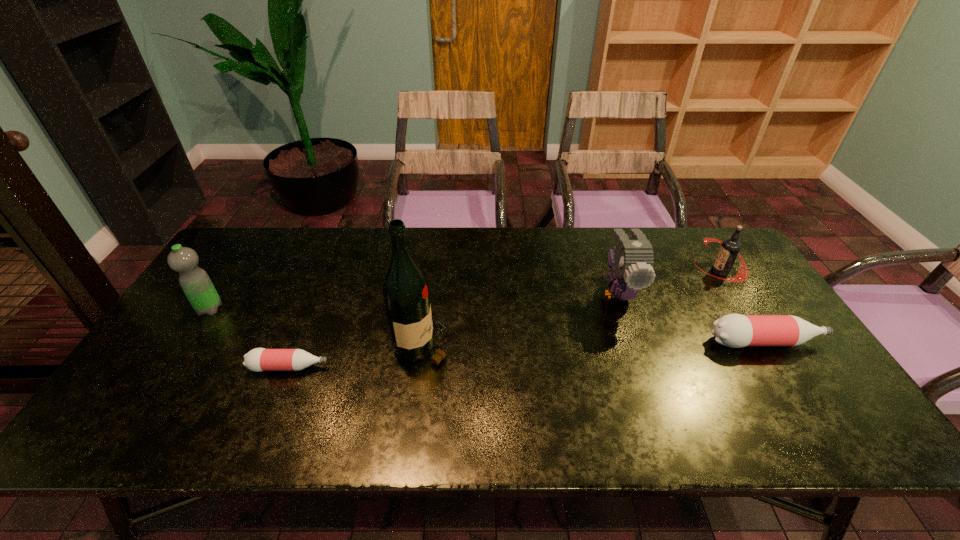
If equal spacing is the goal by inserting an additional bottle among them, please point out a vacant space for this new bottle. Please provide its 2D coordinates. Your answer should be formatted as a tuple, i.e. [(x, y)], where the tuple contains the x and y coordinates of a point satisfying the conditions above.

[(535, 354)]